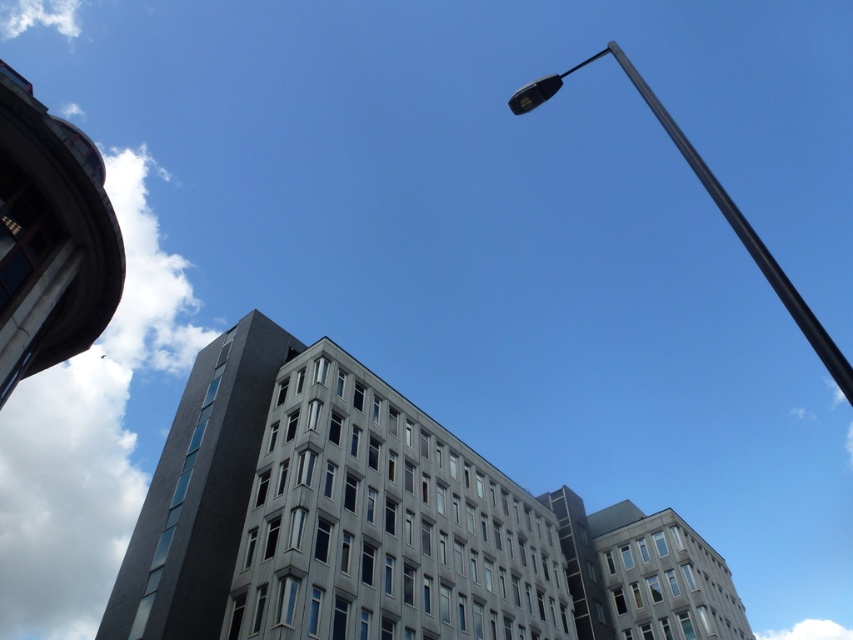
Question: Which object is farther from the camera taking this photo?

Choices:
 (A) black metallic street light at upper right
 (B) gray concrete building at center
 (C) white concrete tower at upper left

Answer: (B)

Question: Which point is farther to the camera?

Choices:
 (A) (260, 419)
 (B) (792, 310)
 (C) (97, 164)

Answer: (A)

Question: Does white concrete tower at upper left appear over black metallic street light at upper right?

Choices:
 (A) no
 (B) yes

Answer: (A)

Question: Considering the real-world distances, which object is farthest from the gray concrete building at center?

Choices:
 (A) dark gray concrete tower at upper left
 (B) black metallic street light at upper right

Answer: (B)

Question: Does gray concrete building at center have a smaller size compared to dark gray concrete tower at upper left?

Choices:
 (A) no
 (B) yes

Answer: (A)

Question: Can you confirm if gray concrete building at center is positioned to the left of dark gray concrete tower at upper left?

Choices:
 (A) no
 (B) yes

Answer: (A)